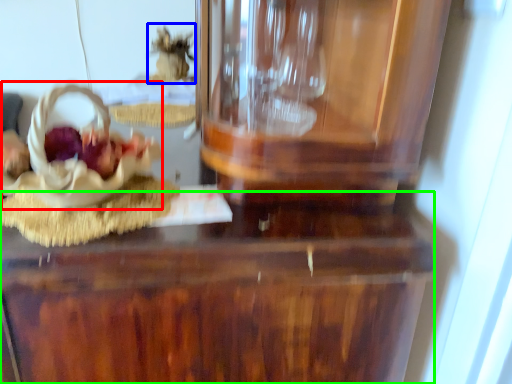
Question: Estimate the real-world distances between objects in this image. Which object is closer to stuff (highlighted by a red box), stuff (highlighted by a blue box) or table (highlighted by a green box)?

Choices:
 (A) stuff
 (B) table

Answer: (B)